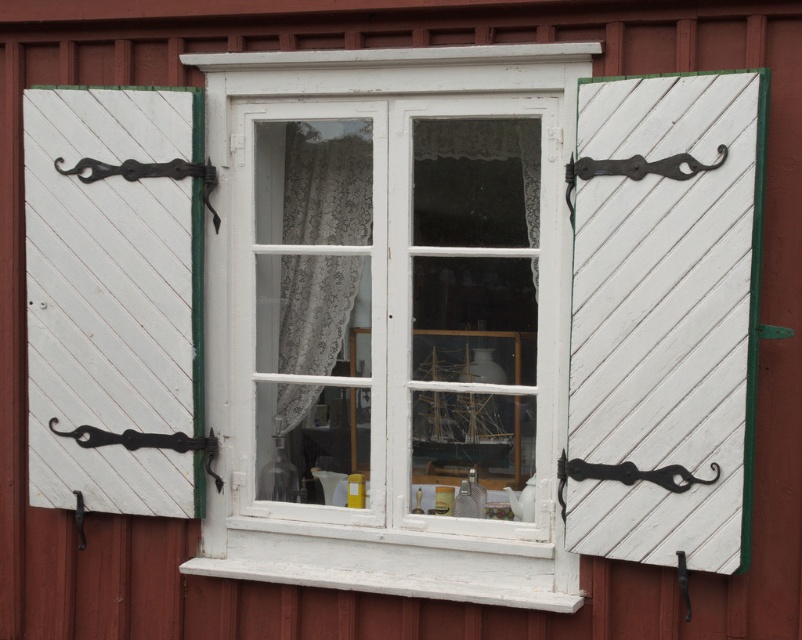
Is white painted wood at right to the left of black metal hook at center from the viewer's perspective?

In fact, white painted wood at right is to the right of black metal hook at center.

In the scene shown: How far apart are white painted wood at right and black metal hook at center?

white painted wood at right is 22.97 centimeters from black metal hook at center.

What do you see at coordinates (665, 317) in the screenshot? I see `white painted wood at right` at bounding box center [665, 317].

You are a GUI agent. You are given a task and a screenshot of the screen. Output one action in this format:
    pyautogui.click(x=<x>, y=<y>)
    Task: Click on the white painted wood at right
    
    Given the screenshot: What is the action you would take?
    pyautogui.click(x=665, y=317)

Is white painted wood at right positioned behind black metal hook at lower right?

No, it is in front of black metal hook at lower right.

Which is behind, point (667, 538) or point (689, 611)?

Point (689, 611)

Identify the location of white painted wood at right. (665, 317).

Can you confirm if white wood at left is thinner than lacy fabric curtain at center?

No, white wood at left is not thinner than lacy fabric curtain at center.

Does white wood at left have a greater width compared to lacy fabric curtain at center?

Yes.

Is point (108, 465) farther from viewer compared to point (302, 310)?

No, it is not.

This screenshot has height=640, width=802. I want to click on white wood at left, so click(112, 294).